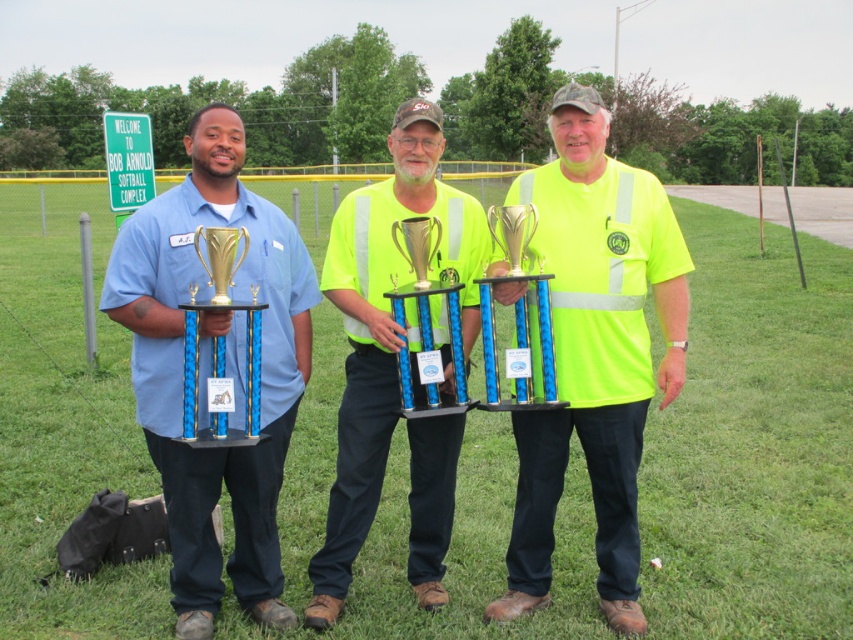
Does point (254, 228) come farther from viewer compared to point (451, 298)?

Yes.

Identify the location of matte blue shirt at center. (181, 369).

Identify the location of matte blue shirt at center. (181, 369).

Does neon yellow reflective shirt at center appear under gold shiny trophy at center?

Correct, neon yellow reflective shirt at center is located below gold shiny trophy at center.

Who is more forward, (596, 164) or (460, 404)?

Point (460, 404) is in front.

Which is in front, point (525, 470) or point (434, 394)?

Point (434, 394) is in front.

Find the location of `neon yellow reflective shirt at center`. neon yellow reflective shirt at center is located at coordinates (595, 352).

Is point (235, 264) behind point (408, 230)?

No, it is not.

Is gold metallic trophy at left closer to camera compared to gold shiny trophy at center?

Yes, it is.

Is point (262, 435) less distant than point (410, 388)?

Yes, it is.

This screenshot has height=640, width=853. I want to click on gold metallic trophy at left, so [196, 346].